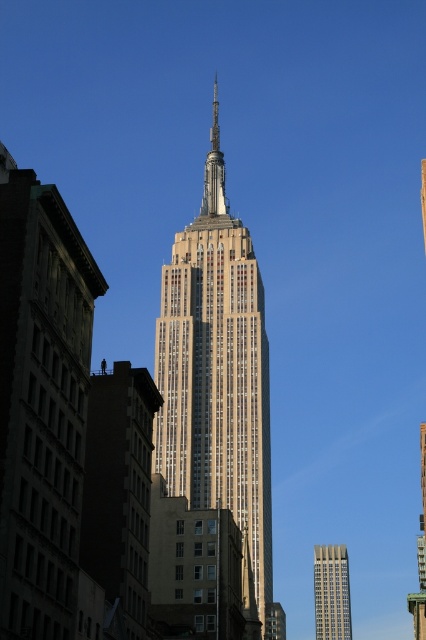
Question: Observing the image, what is the correct spatial positioning of beige stone tower at center in reference to gray glass skyscraper at lower right?

Choices:
 (A) left
 (B) right

Answer: (A)

Question: Can you confirm if beige stone tower at center is bigger than gray glass skyscraper at lower right?

Choices:
 (A) yes
 (B) no

Answer: (A)

Question: Does beige stone tower at center come in front of gray glass skyscraper at lower right?

Choices:
 (A) yes
 (B) no

Answer: (A)

Question: Which object appears closest to the camera in this image?

Choices:
 (A) gray glass skyscraper at lower right
 (B) beige stone tower at center

Answer: (B)